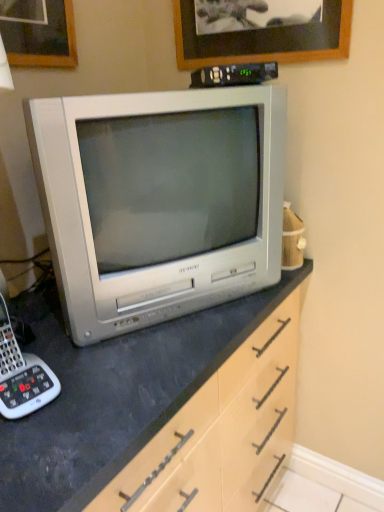
Question: From a real-world perspective, is silver metallic television at center physically located above or below wooden picture frame at upper center?

Choices:
 (A) below
 (B) above

Answer: (A)

Question: Based on their positions, is silver metallic television at center located to the left or right of wooden picture frame at upper center?

Choices:
 (A) left
 (B) right

Answer: (A)

Question: Considering the real-world distances, which object is farthest from the black plastic remote control at upper center?

Choices:
 (A) white plastic corded phone at lower left
 (B) silver metallic television at center
 (C) wooden picture frame at upper center

Answer: (A)

Question: Estimate the real-world distances between objects in this image. Which object is closer to the white plastic corded phone at lower left?

Choices:
 (A) silver metallic television at center
 (B) wooden picture frame at upper center
 (C) black plastic remote control at upper center

Answer: (A)